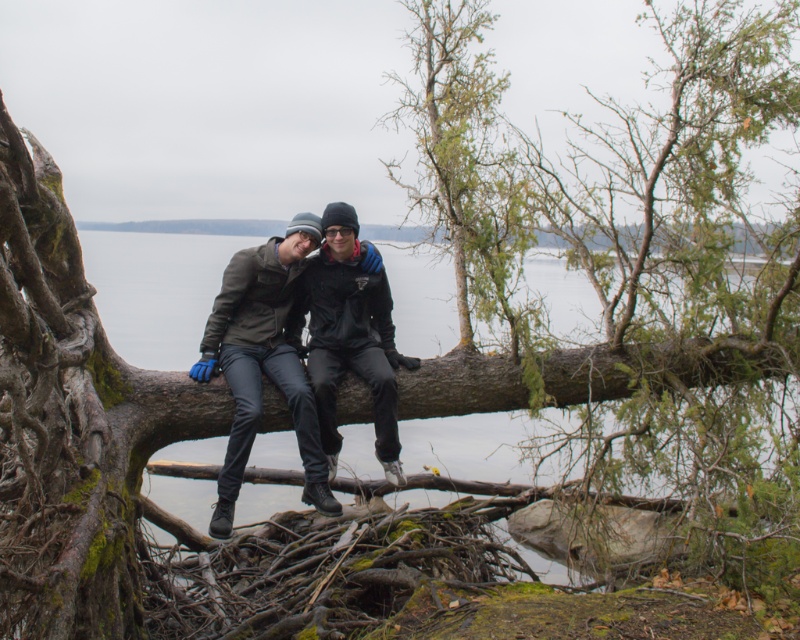
Where is `green rough bark tree at center`? This screenshot has height=640, width=800. green rough bark tree at center is located at coordinates (462, 163).

Is point (513, 157) positioned in front of point (352, 323)?

Yes, point (513, 157) is in front of point (352, 323).

Where is `green rough bark tree at center`? The image size is (800, 640). green rough bark tree at center is located at coordinates (462, 163).

Describe the element at coordinates (288, 349) in the screenshot. The height and width of the screenshot is (640, 800). I see `dark gray leather jacket at center` at that location.

Is point (288, 304) closer to camera compared to point (376, 417)?

That is False.

Locate an element on the screen. Image resolution: width=800 pixels, height=640 pixels. dark gray leather jacket at center is located at coordinates [288, 349].

Is point (449, 228) farther from camera compared to point (280, 241)?

Yes, point (449, 228) is farther from viewer.

Between point (512, 326) and point (252, 371), which one is positioned in front?

Point (252, 371) is more forward.

Locate an element on the screen. Image resolution: width=800 pixels, height=640 pixels. green rough bark tree at center is located at coordinates (462, 163).